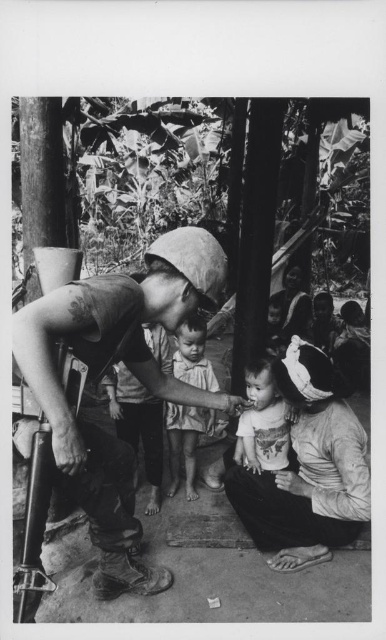
Based on the scene description, which object is larger in size between the matte black helmet at center and the matte white shirt at lower right?

The matte black helmet at center is bigger than the matte white shirt at lower right.